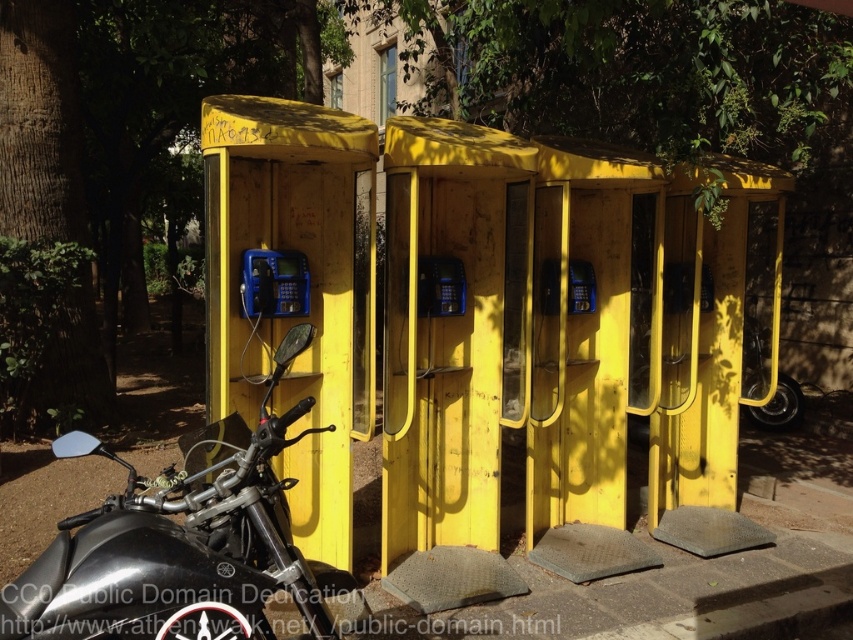
You are standing in front of the telephone booths and want to determine which of the two points, point (71, 582) or point (265, 272), is nearer to you. Based on the scene, which point is closer?

Point (71, 582) is closer to the camera than point (265, 272), so it is the nearer one.

You are a delivery person who needs to park your 1.5 meter wide delivery cart between the black metallic motorcycle at left and the blue plastic payphone at center. Can you fit your cart there without touching either object?

The black metallic motorcycle at left is wider than the blue plastic payphone at center. Since the motorcycle is wider, the space between them might be sufficient for your 1.5 meter wide cart. However, without knowing the exact distance between the two objects, it is uncertain if the cart will fit without touching either object.

You are a delivery person who needs to enter the blue plastic payphone at center to make a call. However, there is a black metallic motorcycle at left blocking the entrance. Can you easily step over the motorcycle to access the payphone?

The black metallic motorcycle at left is much taller than the blue plastic payphone at center, so it might be difficult to step over the motorcycle to access the blue plastic payphone at center.